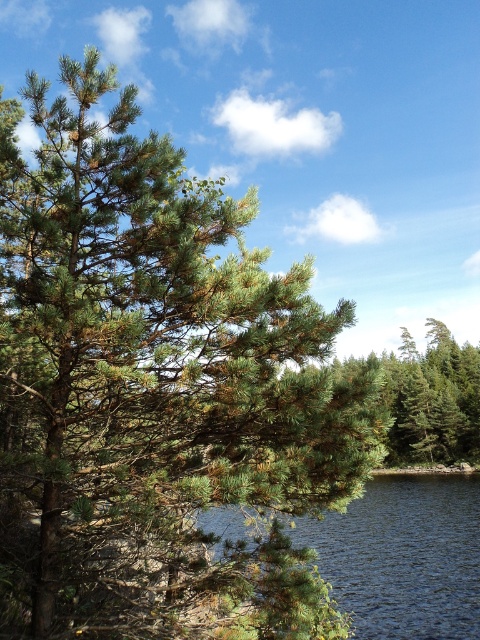
Does point (350, 552) come in front of point (396, 390)?

That is True.

The width and height of the screenshot is (480, 640). Identify the location of transparent blue water at lower center. (404, 556).